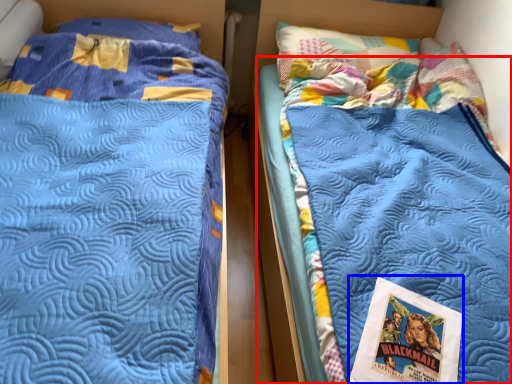
Question: Which of the following is the closest to the observer, mattress (highlighted by a red box) or comic book (highlighted by a blue box)?

Choices:
 (A) mattress
 (B) comic book

Answer: (A)